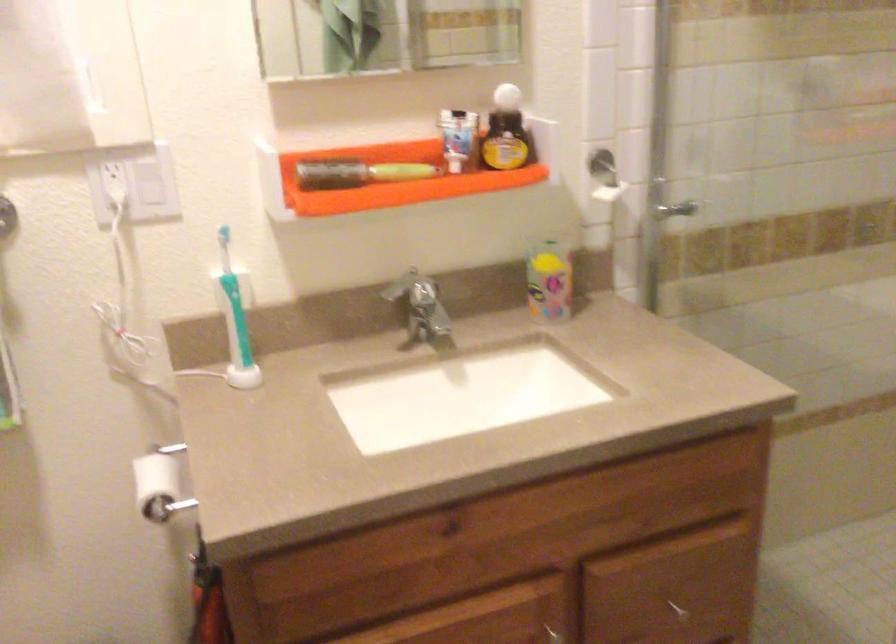
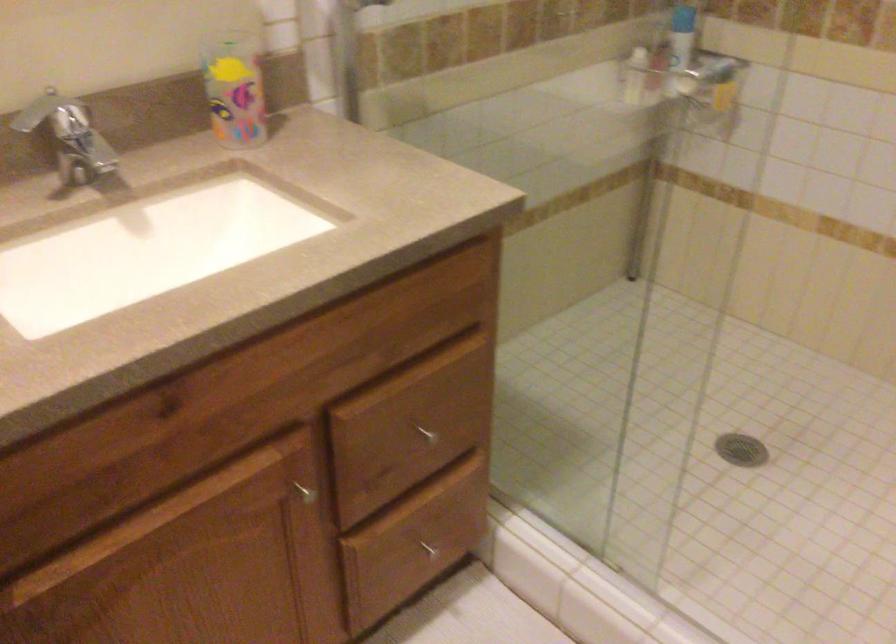
Question: Which direction would the cameraman need to move to produce the second image? Reply with the corresponding letter.

Choices:
 (A) Left
 (B) Right
 (C) Forward
 (D) Backward

Answer: (C)